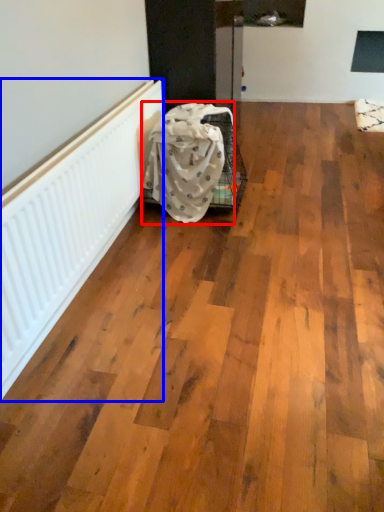
Question: Among these objects, which one is farthest to the camera, blanket (highlighted by a red box) or radiator (highlighted by a blue box)?

Choices:
 (A) blanket
 (B) radiator

Answer: (A)